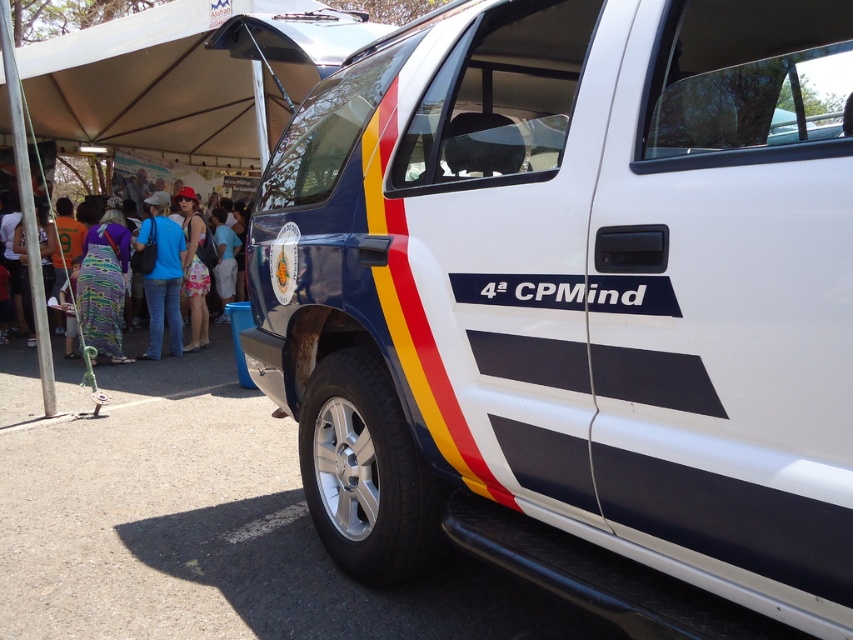
Can you confirm if white glossy police van at center is positioned above printed fabric dress at left?

No, white glossy police van at center is not above printed fabric dress at left.

Does white glossy police van at center have a larger size compared to printed fabric dress at left?

Indeed, white glossy police van at center has a larger size compared to printed fabric dress at left.

Based on the photo, who is more distant from viewer, (843,548) or (233,192)?

The point (233,192) is behind.

The height and width of the screenshot is (640, 853). What are the coordinates of `white glossy police van at center` in the screenshot? It's located at (577, 305).

Looking at this image, does blue jeans at center appear over printed fabric dress at left?

Actually, blue jeans at center is below printed fabric dress at left.

Does point (155, 308) come in front of point (224, 193)?

Yes, it is in front of point (224, 193).

Locate an element on the screen. blue jeans at center is located at coordinates (161, 275).

Looking at this image, can you confirm if white glossy police van at center is smaller than blue jeans at center?

No.

Is white glossy police van at center bigger than blue jeans at center?

Indeed, white glossy police van at center has a larger size compared to blue jeans at center.

Where is `white glossy police van at center`? Image resolution: width=853 pixels, height=640 pixels. white glossy police van at center is located at coordinates (577, 305).